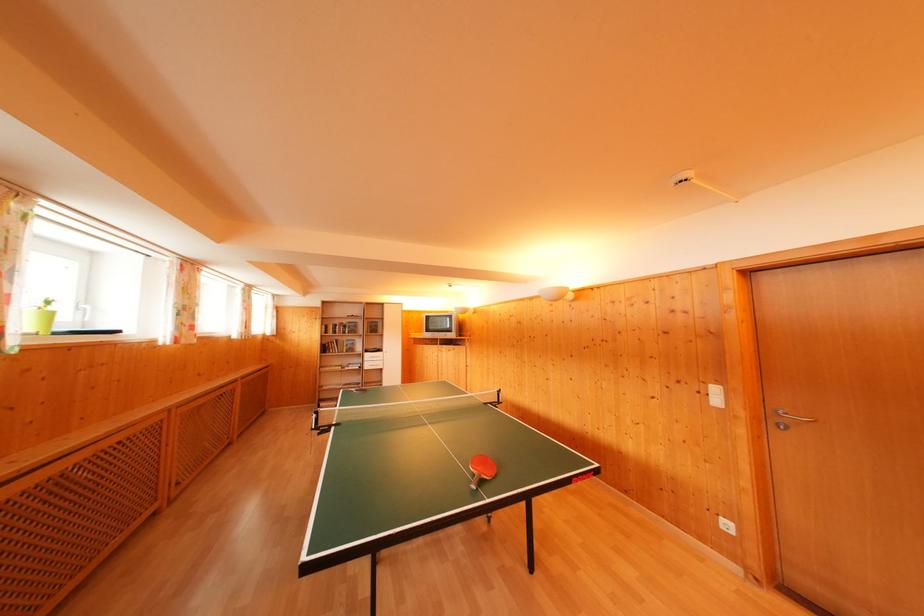
Identify the location of silver door handle. (792, 416).